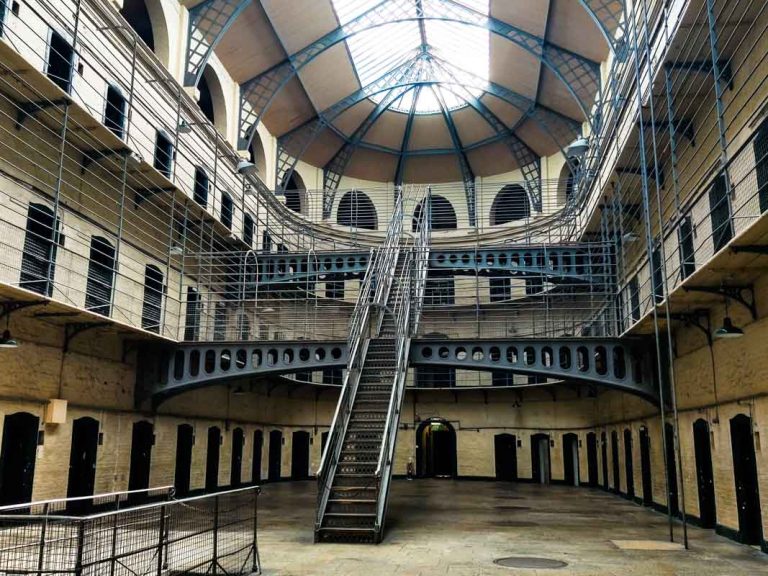
This screenshot has width=768, height=576. Find the location of `metal staircase`. metal staircase is located at coordinates (355, 515), (363, 462), (372, 414), (379, 367).